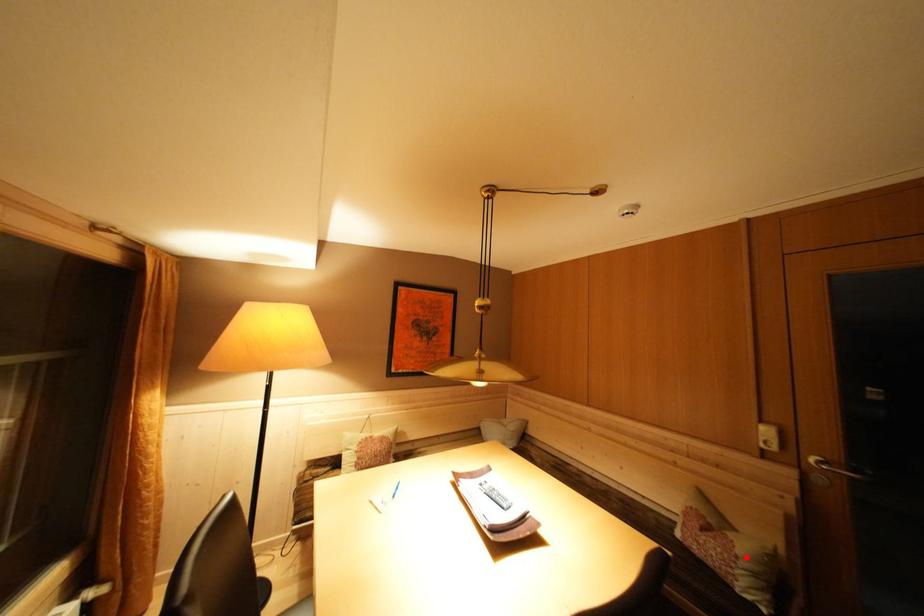
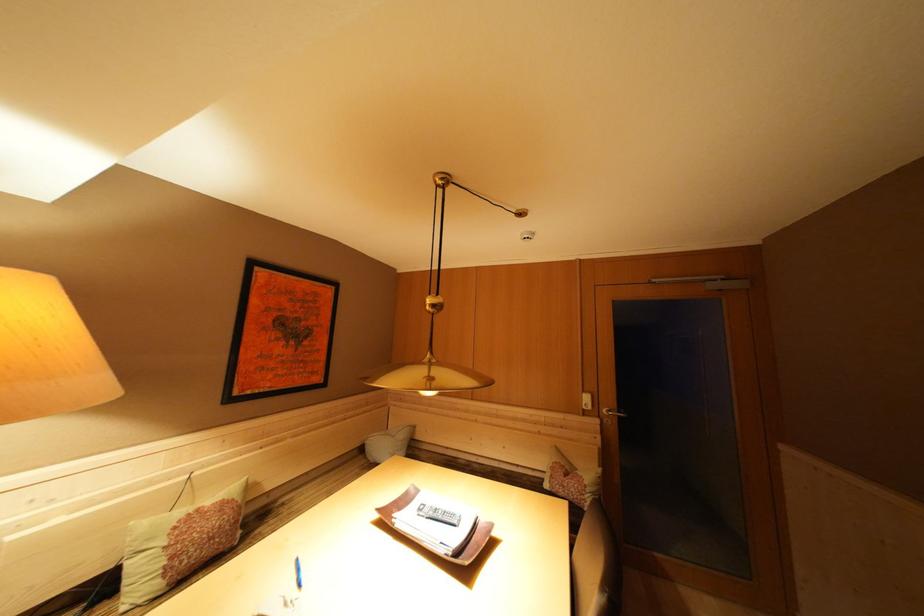
Question: I am providing you with two images of the same scene from different viewpoints. Given a red point in image1, look at the same physical point in image2. Is it:

Choices:
 (A) Closer to the viewpoint
 (B) Farther from the viewpoint

Answer: (B)